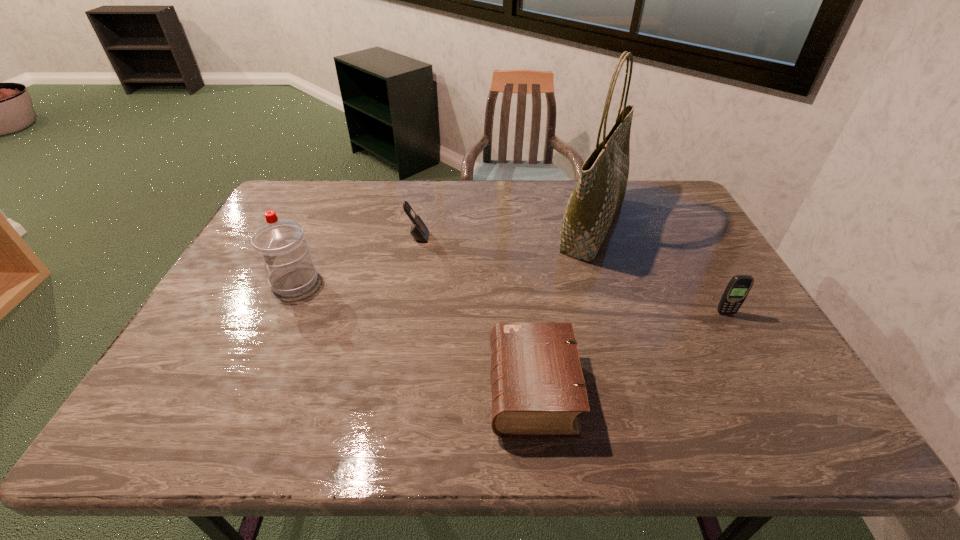
Image resolution: width=960 pixels, height=540 pixels. Identify the location of object that is at the right edge. (739, 286).

Identify the location of free region at the far edge of the desktop. (626, 192).

Image resolution: width=960 pixels, height=540 pixels. Identify the location of blank space at the near edge of the desktop. (439, 417).

In order to click on free space at the left edge of the desktop in this screenshot , I will do `click(244, 273)`.

At what (x,y) coordinates should I click in order to perform the action: click on vacant position at the right edge of the desktop. Please return your answer as a coordinate pair (x, y). Looking at the image, I should click on (756, 380).

You are a GUI agent. You are given a task and a screenshot of the screen. Output one action in this format:
    pyautogui.click(x=<x>, y=<y>)
    Task: Click on the vacant region at the far left corner of the desktop
    
    Given the screenshot: What is the action you would take?
    pyautogui.click(x=286, y=185)

Where is `free point at the far right corner`? The height and width of the screenshot is (540, 960). free point at the far right corner is located at coordinates coord(645,183).

This screenshot has height=540, width=960. Identify the location of free space between the right cellular telephone and the fourth shortest object. (510, 297).

Identify the location of vacant space in between the fourth farthest object and the shopping bag. pyautogui.click(x=660, y=269).

The height and width of the screenshot is (540, 960). What are the coordinates of `free space between the second tallest object and the tallest object` in the screenshot? It's located at (444, 254).